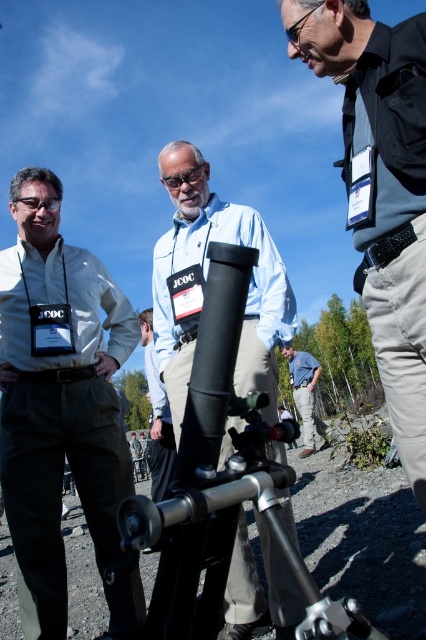
Does matte black telescope at center have a lesser width compared to blue denim shirt at lower center?

Correct, matte black telescope at center's width is less than blue denim shirt at lower center's.

From the picture: Who is more forward, (247, 332) or (299, 368)?

Point (247, 332)

Identify the location of matte black telescope at center. The image size is (426, 640). (199, 298).

How distant is blue denim shirt at lower center from matte black goggles at center?

blue denim shirt at lower center and matte black goggles at center are 28.06 feet apart.

Is blue denim shirt at lower center smaller than matte black goggles at center?

No, blue denim shirt at lower center is not smaller than matte black goggles at center.

Is point (316, 372) positioned before point (195, 182)?

That is False.

Where is `blue denim shirt at lower center`? blue denim shirt at lower center is located at coordinates (305, 396).

Is point (298, 586) farther from viewer compared to point (192, 168)?

No, (298, 586) is in front of (192, 168).

Does matte black telescope at center appear under matte black goggles at center?

Yes, matte black telescope at center is below matte black goggles at center.

Does point (261, 236) come in front of point (173, 173)?

Yes, it is in front of point (173, 173).

Find the location of a particular element. The image size is (426, 640). matte black telescope at center is located at coordinates (199, 298).